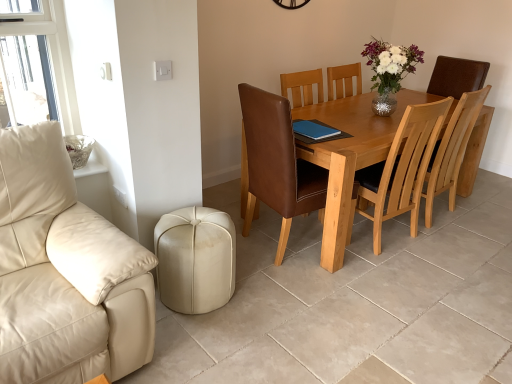
Locate an element on the screen. free space above blue leather pad at center (from a real-world perspective) is located at coordinates (311, 129).